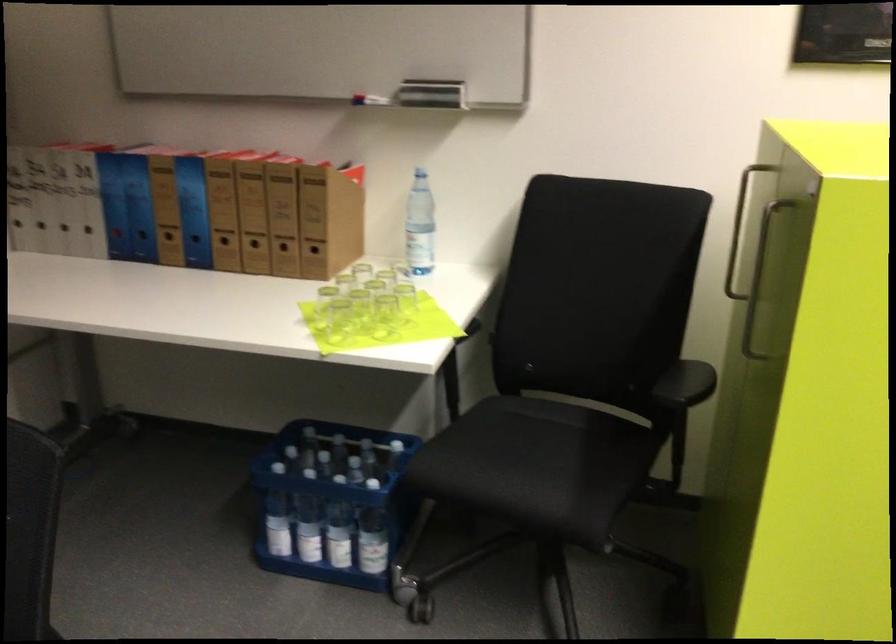
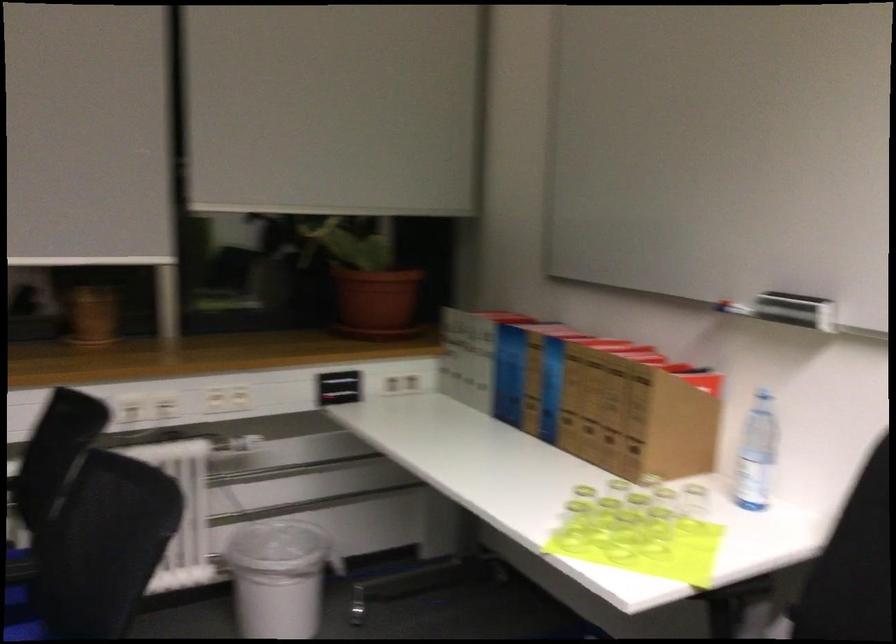
Question: Based on the continuous images, in which direction is the camera rotating? Reply with the corresponding letter.

Choices:
 (A) Left
 (B) Right
 (C) Up
 (D) Down

Answer: (A)